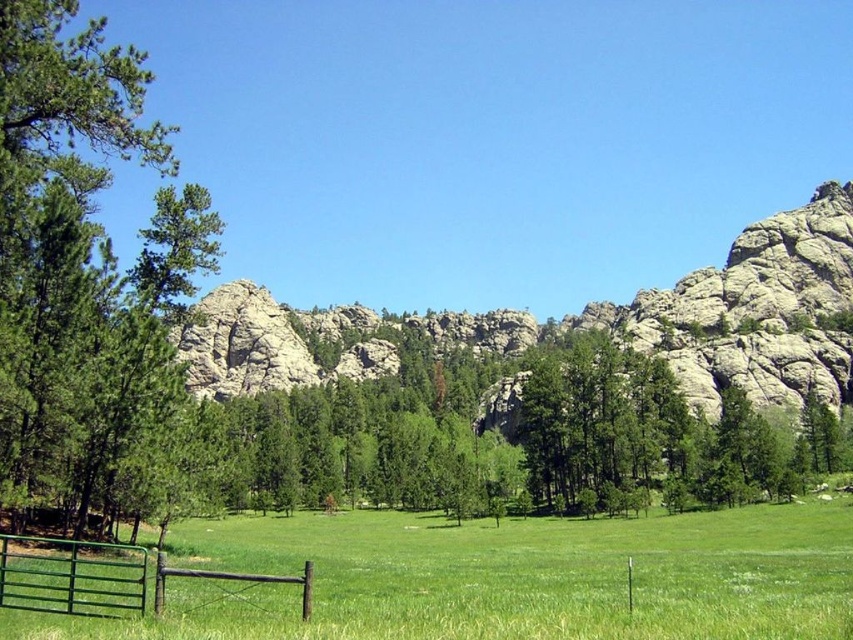
Does green matte tree at left have a larger size compared to rocky gray mountain at center?

No, green matte tree at left is not bigger than rocky gray mountain at center.

How distant is green matte tree at left from rocky gray mountain at center?

green matte tree at left is 49.39 meters away from rocky gray mountain at center.

Does point (83, 243) lie in front of point (706, 356)?

That is True.

Where is `green matte tree at left`? The image size is (853, 640). green matte tree at left is located at coordinates (79, 253).

Is rocky gray mountain at center taller than green wooden gate at lower left?

Correct, rocky gray mountain at center is much taller as green wooden gate at lower left.

Who is more distant from viewer, (534, 324) or (161, 566)?

Point (534, 324)

Image resolution: width=853 pixels, height=640 pixels. Find the location of `rocky gray mountain at center`. rocky gray mountain at center is located at coordinates (752, 312).

Is point (36, 467) closer to viewer compared to point (38, 550)?

No, (36, 467) is behind (38, 550).

Between green matte tree at left and green wooden gate at lower left, which one has more height?

green matte tree at left

Who is more forward, [45,224] or [4,554]?

Positioned in front is point [4,554].

Locate an element on the screen. green matte tree at left is located at coordinates (79, 253).